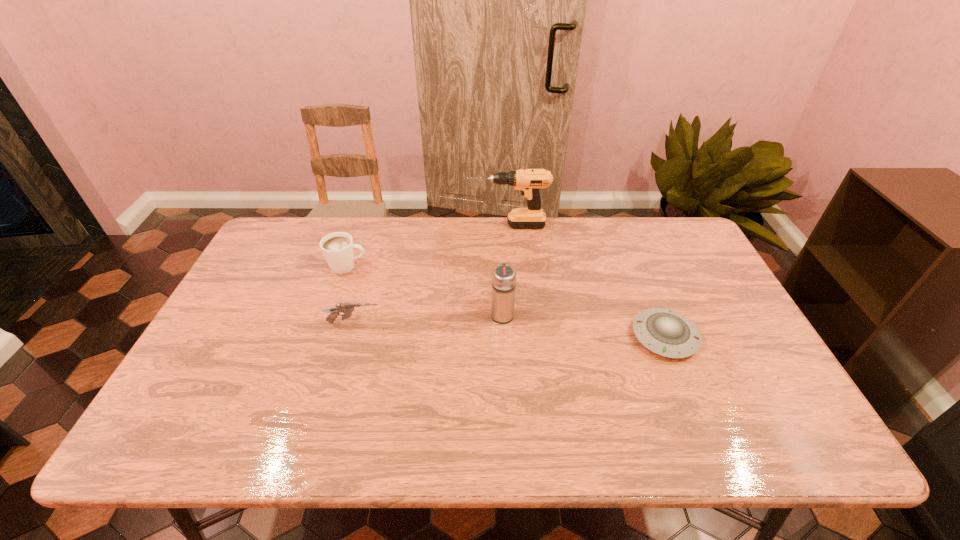
This screenshot has height=540, width=960. I want to click on the farthest object, so click(529, 181).

You are a GUI agent. You are given a task and a screenshot of the screen. Output one action in this format:
    pyautogui.click(x=<x>, y=<y>)
    Task: Click on the drill
    The width and height of the screenshot is (960, 540).
    Given the screenshot: What is the action you would take?
    pyautogui.click(x=529, y=181)

Where is `thermos bottle`? thermos bottle is located at coordinates (503, 277).

This screenshot has width=960, height=540. I want to click on the fourth nearest object, so click(x=337, y=248).

This screenshot has height=540, width=960. Find the location of `the third tallest object`. the third tallest object is located at coordinates (337, 248).

You are a GUI agent. You are given a task and a screenshot of the screen. Output one action in this format:
    pyautogui.click(x=<x>, y=<y>)
    Task: Click on the gun
    The image size is (960, 540).
    Given the screenshot: What is the action you would take?
    pyautogui.click(x=347, y=308)

Find the location of a particular element. saucer is located at coordinates (665, 332).

Locate an element on the screen. the shortest object is located at coordinates (665, 332).

Find the location of a particular element. The image size is (960, 540). vacant area situated at the tip of the farthest object is located at coordinates (373, 226).

You are a GUI agent. You are given a task and a screenshot of the screen. Output one action in this format:
    pyautogui.click(x=<x>, y=<y>)
    Task: Click on the vacant space located 0.110m at the tip of the farthest object
    
    Given the screenshot: What is the action you would take?
    pyautogui.click(x=436, y=226)